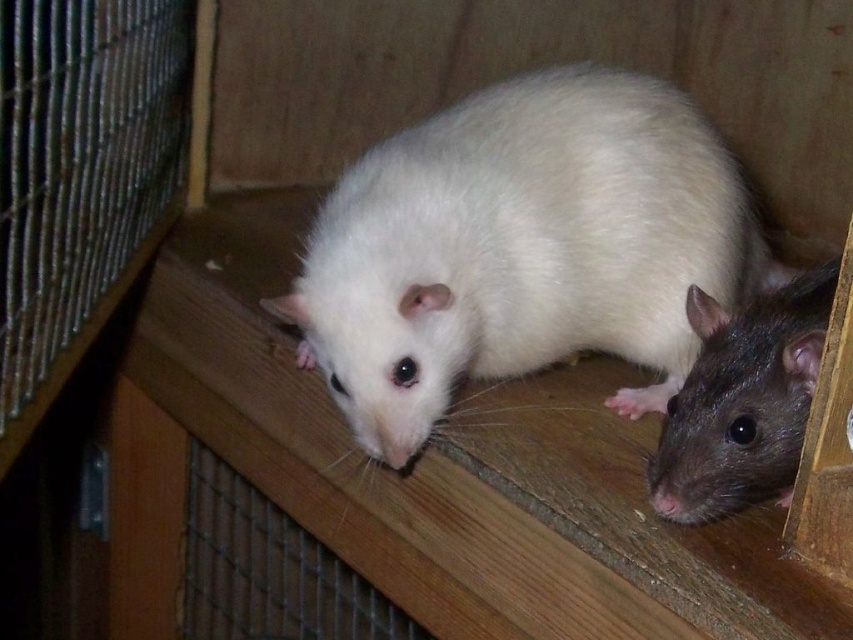
Question: Is white fluffy hamster at center wider than shiny gray fur at center?

Choices:
 (A) no
 (B) yes

Answer: (B)

Question: Is white fluffy hamster at center bigger than shiny gray fur at center?

Choices:
 (A) yes
 (B) no

Answer: (A)

Question: Can you confirm if white fluffy hamster at center is wider than shiny gray fur at center?

Choices:
 (A) yes
 (B) no

Answer: (A)

Question: Which point appears closest to the camera in this image?

Choices:
 (A) (751, 378)
 (B) (500, 156)

Answer: (A)

Question: Which point is closer to the camera taking this photo?

Choices:
 (A) (781, 339)
 (B) (729, 268)

Answer: (A)